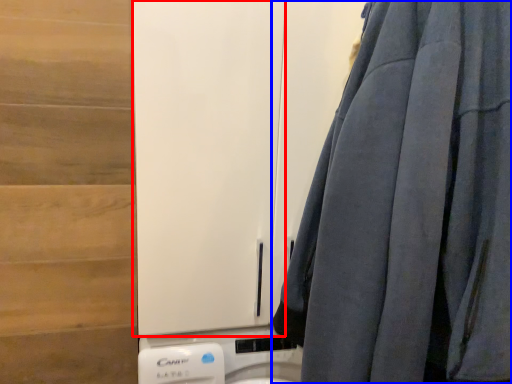
Question: Among these objects, which one is farthest to the camera, barn door (highlighted by a red box) or curtain (highlighted by a blue box)?

Choices:
 (A) barn door
 (B) curtain

Answer: (A)